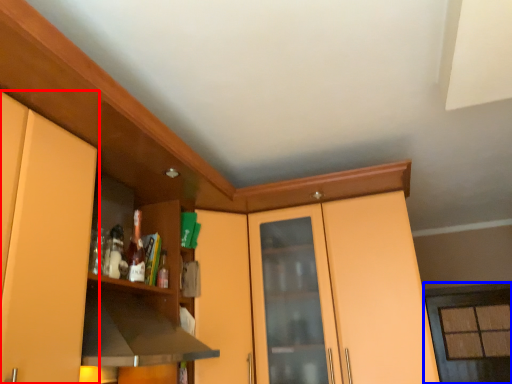
Question: Which object is closer to the camera taking this photo, cabinetry (highlighted by a red box) or window (highlighted by a blue box)?

Choices:
 (A) cabinetry
 (B) window

Answer: (A)